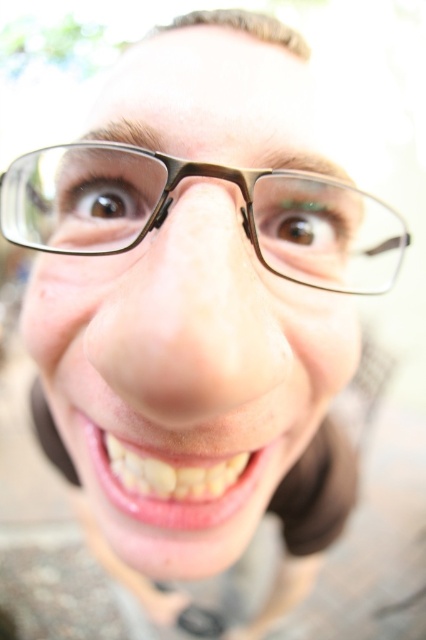
You are using a camera with a 10cm focal length and want to focus on the matte brown glasses at center. Given the fisheye distortion in the image, will the glasses appear closer to the center or the edge of the frame?

The matte brown glasses at center are located at point (x=184, y=376) in the 2D image. Since fisheye lenses distort the perspective, objects closer to the center appear less distorted and more accurately positioned. The glasses are near the center coordinates, so they will appear closer to the center of the frame despite the fisheye effect.

You are a photographer trying to adjust the glasses on the person in the image. You need to move the matte brown glasses at center to the left side of the transparent plastic glasses at center. Is this possible without overlapping them?

The matte brown glasses at center is currently positioned on the right side of transparent plastic glasses at center. To move it to the left side without overlapping, there must be enough space between them. However, since both glasses are at the center, moving the matte brown glasses to the left might cause overlap unless there is sufficient clearance. Without knowing the exact distance between them, it is uncertain if this adjustment can be made without overlapping.

You are a photographer trying to adjust the focus of your camera to capture the transparent plastic glasses at center. Based on the scene description, where should you focus your camera?

You should focus your camera at point (170,204) to capture the transparent plastic glasses at center.